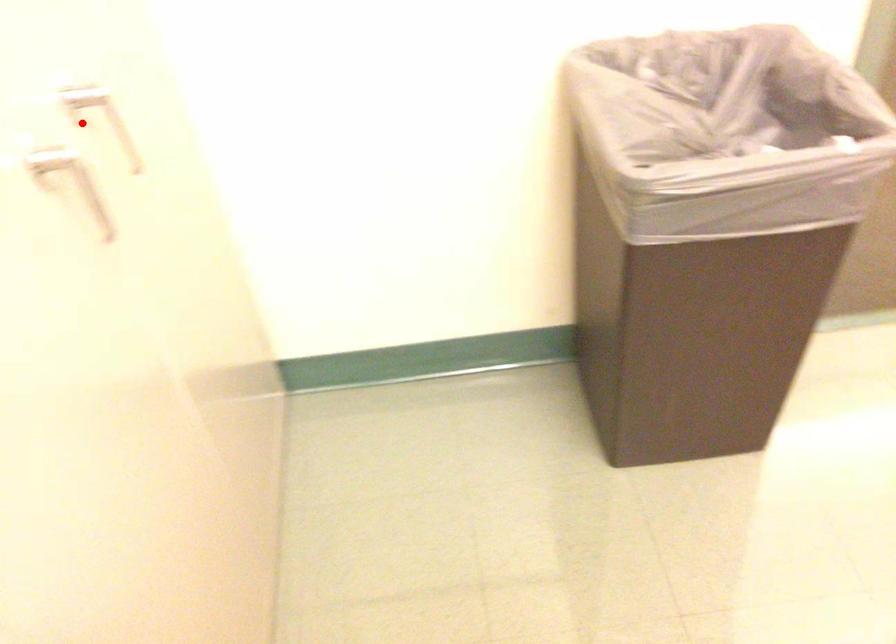
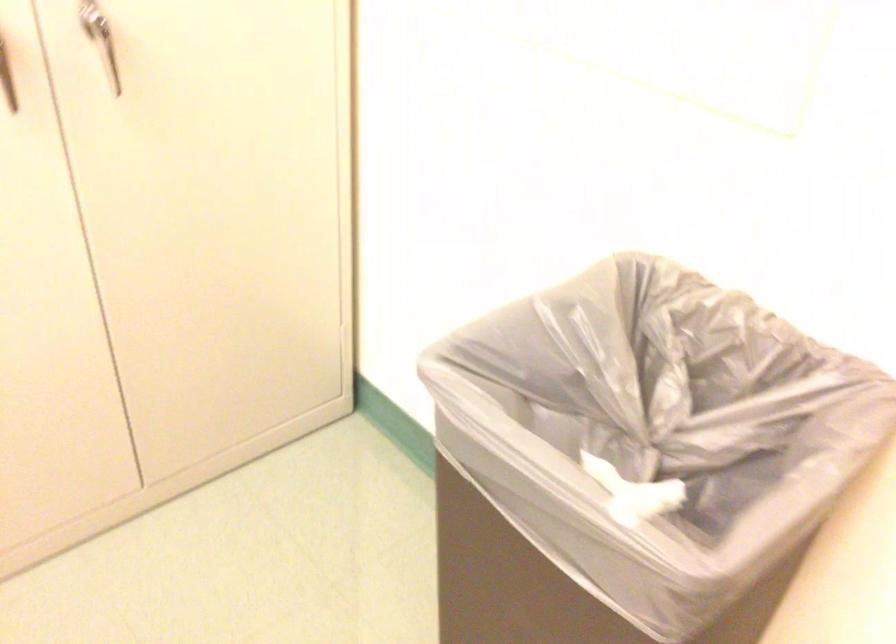
In the second image, find the point that corresponds to the highlighted location in the first image.

(106, 51)